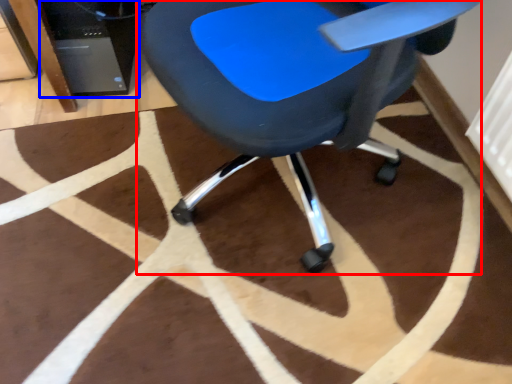
Question: Which of the following is the closest to the observer, chair (highlighted by a red box) or computer tower (highlighted by a blue box)?

Choices:
 (A) chair
 (B) computer tower

Answer: (A)